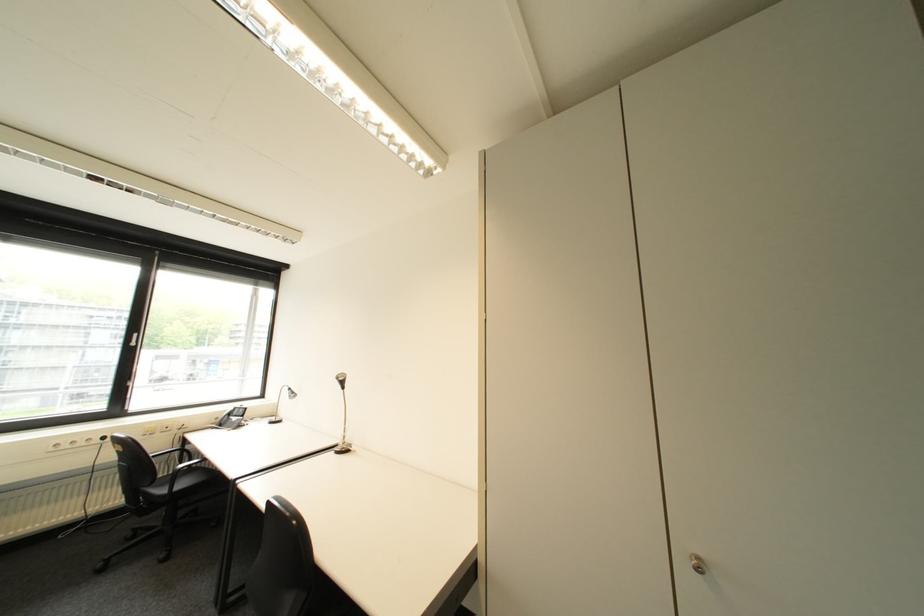
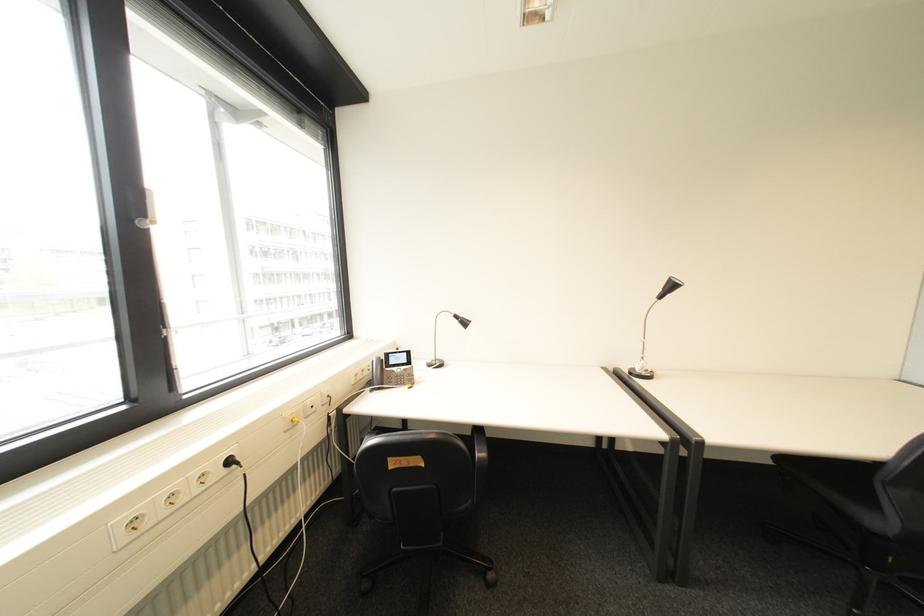
In the second image, find the point that corresponds to (x=114, y=439) in the first image.

(239, 463)